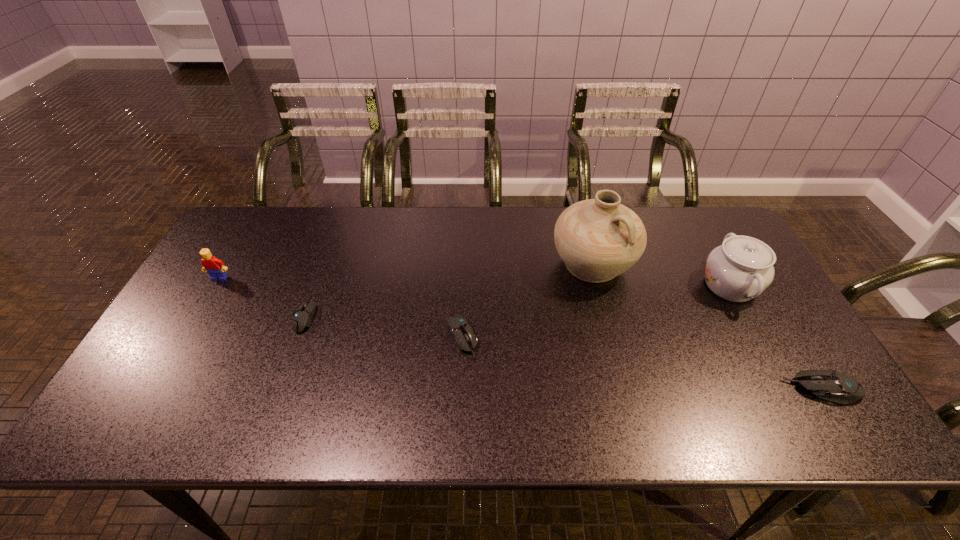
Identify the location of computer mouse located at the right edge. (830, 385).

Find the location of a particular element. The width and height of the screenshot is (960, 540). chinaware at the right edge is located at coordinates (740, 269).

The width and height of the screenshot is (960, 540). What are the coordinates of `object that is positioned at the near right corner` in the screenshot? It's located at (830, 385).

In the image, there is a desktop. Where is `vacant space at the far edge`? The width and height of the screenshot is (960, 540). vacant space at the far edge is located at coordinates pos(356,220).

Locate an element on the screen. The image size is (960, 540). free space at the near edge of the desktop is located at coordinates (273, 398).

This screenshot has height=540, width=960. I want to click on vacant region at the right edge of the desktop, so click(x=751, y=350).

Where is `vacant region at the far left corner`? Image resolution: width=960 pixels, height=540 pixels. vacant region at the far left corner is located at coordinates (269, 220).

This screenshot has width=960, height=540. I want to click on free spot at the far right corner of the desktop, so click(698, 226).

Locate an element on the screen. vacant space in between the pottery and the fourth shortest object is located at coordinates (406, 272).

The width and height of the screenshot is (960, 540). Identify the location of empty space that is in between the fourth shortest object and the leftmost computer mouse. (262, 297).